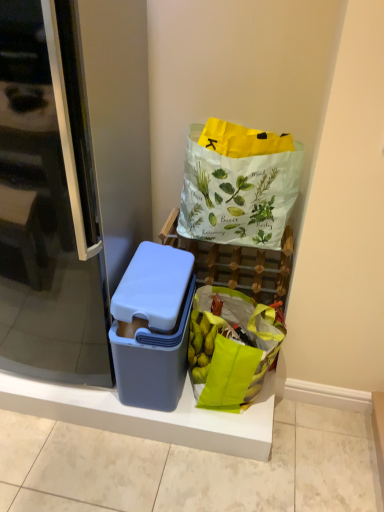
Question: Is white paper bag with green leaf illustrations at upper right thinner than green fabric grocery bag at lower right?

Choices:
 (A) no
 (B) yes

Answer: (A)

Question: Is white paper bag with green leaf illustrations at upper right completely or partially outside of green fabric grocery bag at lower right?

Choices:
 (A) yes
 (B) no

Answer: (A)

Question: Could you tell me if white paper bag with green leaf illustrations at upper right is facing green fabric grocery bag at lower right?

Choices:
 (A) no
 (B) yes

Answer: (A)

Question: Is white paper bag with green leaf illustrations at upper right oriented away from green fabric grocery bag at lower right?

Choices:
 (A) yes
 (B) no

Answer: (B)

Question: Considering the relative positions of white paper bag with green leaf illustrations at upper right and green fabric grocery bag at lower right in the image provided, is white paper bag with green leaf illustrations at upper right to the left of green fabric grocery bag at lower right from the viewer's perspective?

Choices:
 (A) no
 (B) yes

Answer: (A)

Question: Considering the positions of matte plastic container at left and green fabric grocery bag at lower right in the image, is matte plastic container at left wider or thinner than green fabric grocery bag at lower right?

Choices:
 (A) wide
 (B) thin

Answer: (A)

Question: Is point (256, 437) closer or farther from the camera than point (223, 292)?

Choices:
 (A) closer
 (B) farther

Answer: (A)

Question: Considering their positions, is matte plastic container at left located in front of or behind green fabric grocery bag at lower right?

Choices:
 (A) front
 (B) behind

Answer: (B)

Question: From a real-world perspective, is matte plastic container at left positioned above or below green fabric grocery bag at lower right?

Choices:
 (A) below
 (B) above

Answer: (A)

Question: From a real-world perspective, is matte plastic basket at center above or below green fabric grocery bag at lower right?

Choices:
 (A) below
 (B) above

Answer: (B)

Question: Considering the positions of matte plastic basket at center and green fabric grocery bag at lower right in the image, is matte plastic basket at center wider or thinner than green fabric grocery bag at lower right?

Choices:
 (A) wide
 (B) thin

Answer: (B)

Question: Which is correct: matte plastic basket at center is inside green fabric grocery bag at lower right, or outside of it?

Choices:
 (A) outside
 (B) inside

Answer: (A)

Question: Considering the relative positions of matte plastic basket at center and green fabric grocery bag at lower right in the image provided, is matte plastic basket at center to the left or to the right of green fabric grocery bag at lower right?

Choices:
 (A) left
 (B) right

Answer: (A)

Question: In the image, is matte plastic basket at center positioned in front of or behind white paper bag with green leaf illustrations at upper right?

Choices:
 (A) behind
 (B) front

Answer: (A)

Question: From the image's perspective, is matte plastic basket at center positioned above or below white paper bag with green leaf illustrations at upper right?

Choices:
 (A) below
 (B) above

Answer: (A)